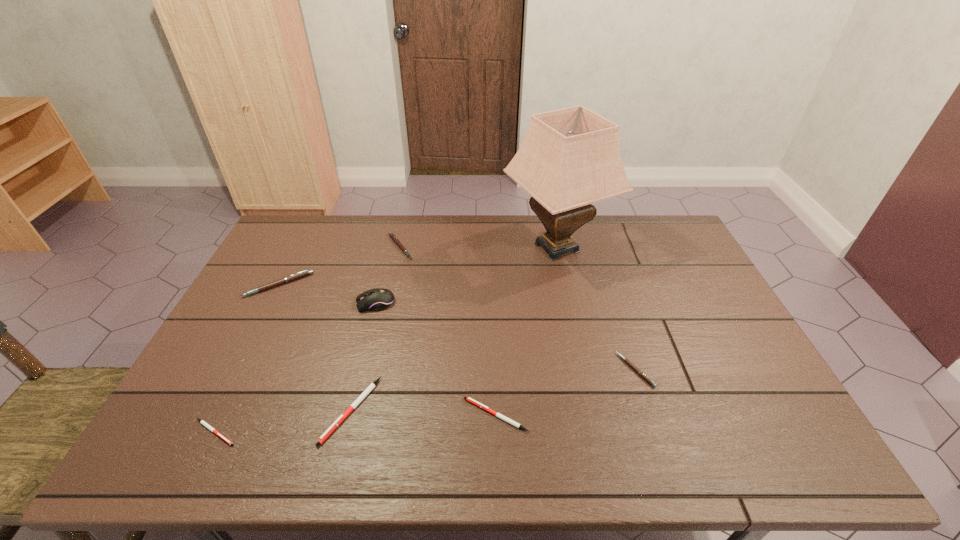
Where is `vacant area situated at the nib of the rightmost pink pen`? The width and height of the screenshot is (960, 540). vacant area situated at the nib of the rightmost pink pen is located at coordinates (583, 370).

Identify the location of free space located 0.050m at the nib of the rightmost pink pen. This screenshot has width=960, height=540. (602, 370).

Find the location of a particular element. The width and height of the screenshot is (960, 540). blank area located 0.250m on the clicker of the second smallest white pen is located at coordinates (360, 415).

You are a GUI agent. You are given a task and a screenshot of the screen. Output one action in this format:
    pyautogui.click(x=<x>, y=<y>)
    Task: Click on the vacant space situated 0.260m on the clicker of the second smallest white pen
    
    Given the screenshot: What is the action you would take?
    pyautogui.click(x=356, y=415)

Find the location of a particular element. The width and height of the screenshot is (960, 540). vacant space located on the clicker of the second smallest white pen is located at coordinates (426, 415).

You are a GUI agent. You are given a task and a screenshot of the screen. Output one action in this format:
    pyautogui.click(x=<x>, y=<y>)
    Task: Click on the free space located on the clicker of the shortest object
    
    Given the screenshot: What is the action you would take?
    pyautogui.click(x=372, y=433)

Identify the location of lampshade situated at the far edge. (570, 158).

You are a GUI agent. You are given a task and a screenshot of the screen. Output one action in this format:
    pyautogui.click(x=<x>, y=<y>)
    Task: Click on the pen at the far edge
    
    Given the screenshot: What is the action you would take?
    click(x=391, y=234)

Image resolution: width=960 pixels, height=540 pixels. I want to click on object that is at the near left corner, so click(202, 422).

In the image, there is a desktop. Where is `vacant region at the far edge`? The height and width of the screenshot is (540, 960). vacant region at the far edge is located at coordinates (383, 237).